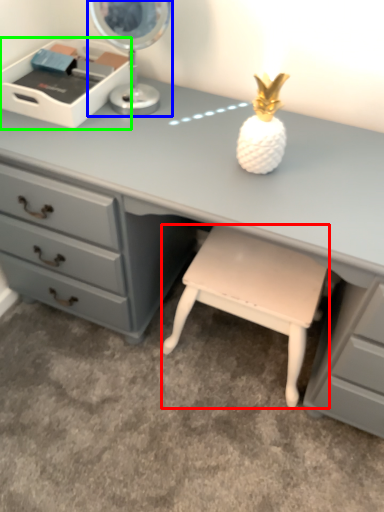
Question: Which is nearer to the stool (highlighted by a red box)? table lamp (highlighted by a blue box) or writing desk (highlighted by a green box).

Choices:
 (A) table lamp
 (B) writing desk

Answer: (A)